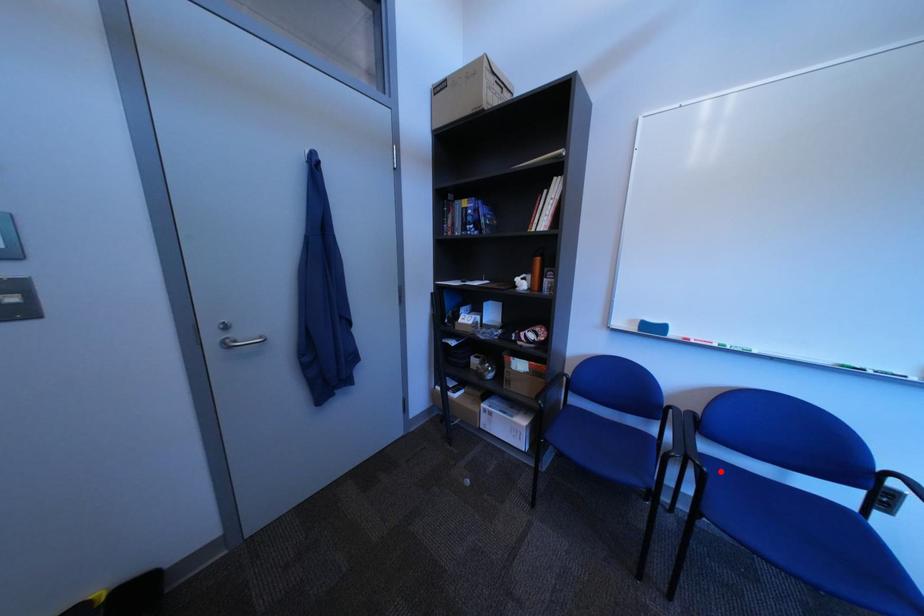
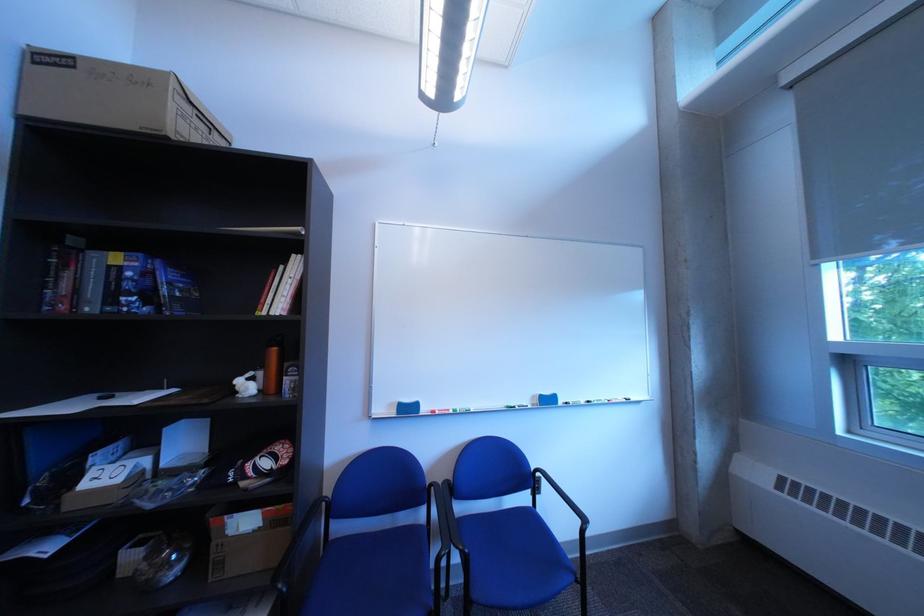
Question: A red point is marked in image1. In image2, is the corresponding 3D point closer to the camera or farther? Reply with the corresponding letter.

Choices:
 (A) The corresponding 3D point is closer.
 (B) The corresponding 3D point is farther.

Answer: (A)